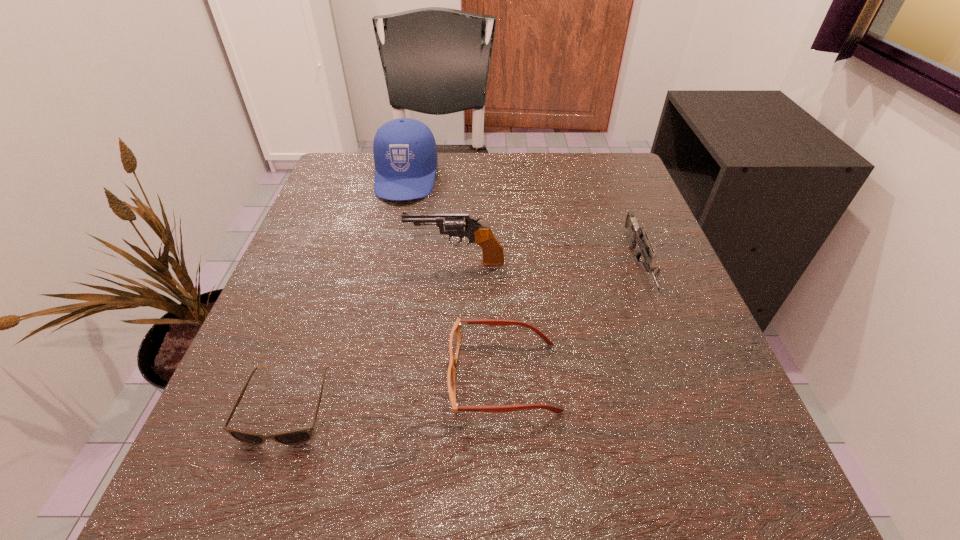
Locate an element on the screen. The image size is (960, 540). unoccupied position between the right gun and the left gun is located at coordinates (547, 264).

Locate an element on the screen. This screenshot has height=540, width=960. free spot between the left gun and the rightmost object is located at coordinates (547, 264).

Where is `vacant area that lies between the sunglasses and the shorter gun`? vacant area that lies between the sunglasses and the shorter gun is located at coordinates (464, 336).

You are a GUI agent. You are given a task and a screenshot of the screen. Output one action in this format:
    pyautogui.click(x=<x>, y=<y>)
    Task: Click on the free space between the shortest object and the third tallest object
    This screenshot has height=540, width=960.
    Given the screenshot: What is the action you would take?
    pyautogui.click(x=464, y=336)

You are a GUI agent. You are given a task and a screenshot of the screen. Output one action in this format:
    pyautogui.click(x=<x>, y=<y>)
    Task: Click on the free space between the farthest object and the rightmost object
    This screenshot has height=540, width=960.
    Given the screenshot: What is the action you would take?
    pyautogui.click(x=522, y=221)

This screenshot has width=960, height=540. I want to click on unoccupied area between the shortest object and the right gun, so click(464, 336).

I want to click on free point between the shorter gun and the cap, so click(x=522, y=221).

Find the location of `object that ranks as the closest to the left gun`. object that ranks as the closest to the left gun is located at coordinates (455, 337).

You are a GUI agent. You are given a task and a screenshot of the screen. Output one action in this format:
    pyautogui.click(x=<x>, y=<y>)
    Task: Click on the object that is the third closest to the shortest object
    
    Given the screenshot: What is the action you would take?
    pyautogui.click(x=405, y=153)

Where is `blank area in the image that satisfies the following two spatial constraints: 1. along the barrel of the taller gun; 2. on the front-facing side of the cap`? The width and height of the screenshot is (960, 540). blank area in the image that satisfies the following two spatial constraints: 1. along the barrel of the taller gun; 2. on the front-facing side of the cap is located at coordinates (461, 178).